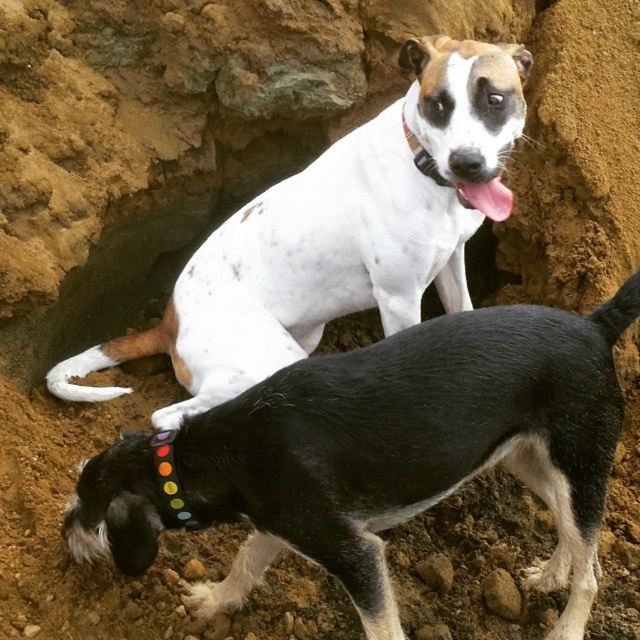
Question: Among these objects, which one is farthest from the camera?

Choices:
 (A) rainbow fabric neckband at lower center
 (B) black fabric neckband at upper center

Answer: (B)

Question: In this image, where is white speckled fur at center located relative to rainbow fabric neckband at lower center?

Choices:
 (A) above
 (B) below

Answer: (A)

Question: Among these points, which one is nearest to the camera?

Choices:
 (A) (344, 433)
 (B) (428, 164)
 (C) (252, 344)

Answer: (A)

Question: Which point is closer to the camera taking this photo?

Choices:
 (A) (396, 225)
 (B) (531, 419)

Answer: (B)

Question: Does black smooth dog at center come in front of white speckled fur at center?

Choices:
 (A) no
 (B) yes

Answer: (B)

Question: Where is black smooth dog at center located in relation to black fabric neckband at upper center in the image?

Choices:
 (A) right
 (B) left

Answer: (B)